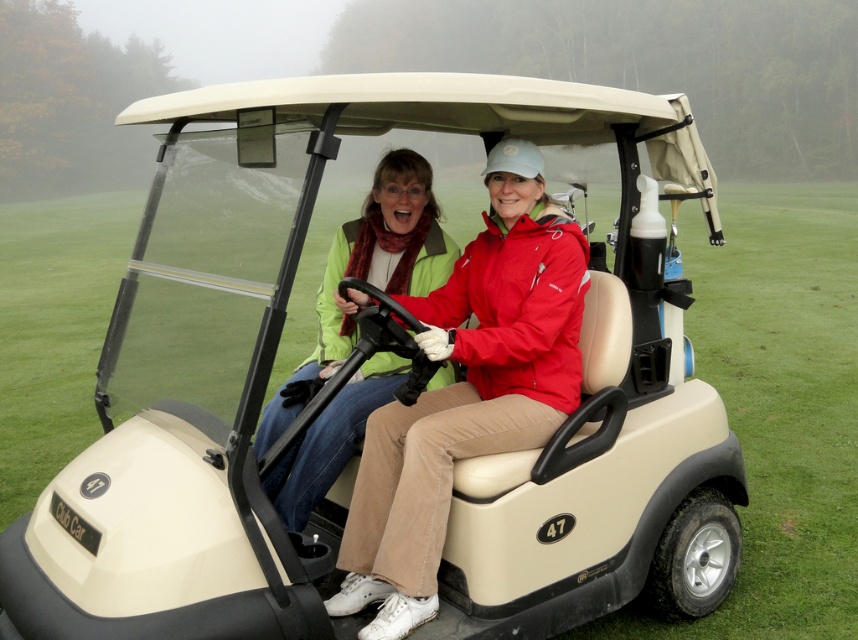
Question: Which of the following is the closest to the observer?

Choices:
 (A) green matte jacket at center
 (B) matte green jacket at center

Answer: (A)

Question: Which of the following is the farthest from the observer?

Choices:
 (A) (415, 588)
 (B) (370, 368)

Answer: (B)

Question: Among these points, which one is nearest to the camera?

Choices:
 (A) (431, 572)
 (B) (421, 243)

Answer: (A)

Question: From the image, what is the correct spatial relationship of matte green jacket at center in relation to green matte jacket at center?

Choices:
 (A) above
 (B) below

Answer: (B)

Question: Is matte green jacket at center thinner than green matte jacket at center?

Choices:
 (A) yes
 (B) no

Answer: (B)

Question: Can you confirm if matte green jacket at center is bigger than green matte jacket at center?

Choices:
 (A) yes
 (B) no

Answer: (A)